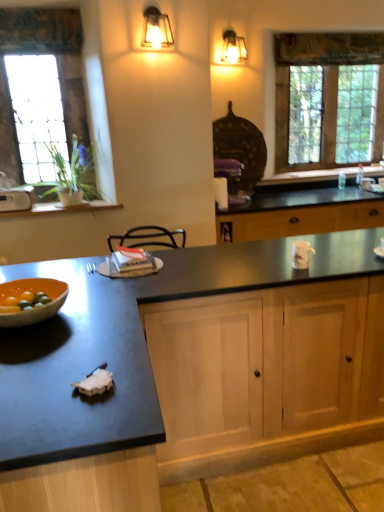
You are a GUI agent. You are given a task and a screenshot of the screen. Output one action in this format:
    pyautogui.click(x=<x>, y=<y>)
    Task: Click on the vacant space to the right of white crumbly food at center
    The height and width of the screenshot is (512, 384).
    Given the screenshot: What is the action you would take?
    pos(136,387)